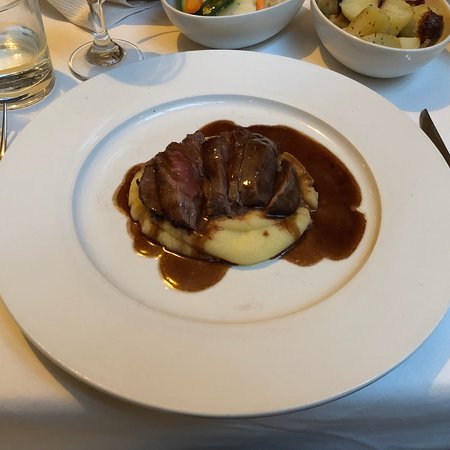
Locate an element on the screen. The width and height of the screenshot is (450, 450). dish with vegetables is located at coordinates (218, 21).